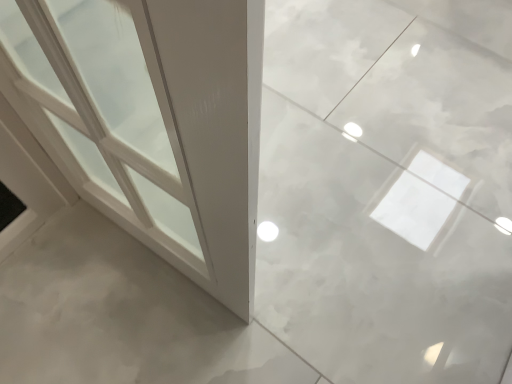
In order to face white polished concrete at center, should I rotate leftwards or rightwards?

Rotate your view left by about 21.796°.

Describe the element at coordinates (122, 316) in the screenshot. I see `white polished concrete at center` at that location.

Find the location of a particular element. white polished concrete at center is located at coordinates (122, 316).

Locate an element on the screen. Image resolution: width=512 pixels, height=384 pixels. white polished concrete at center is located at coordinates (122, 316).